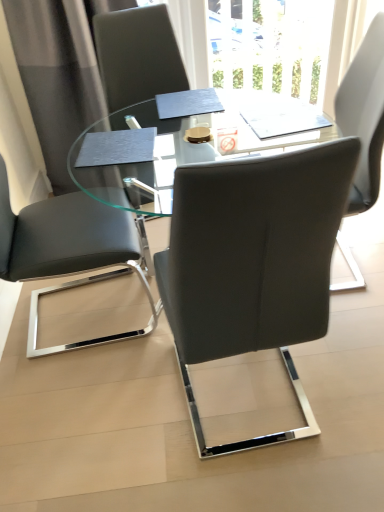
Image resolution: width=384 pixels, height=512 pixels. What are the coordinates of `vacant space underneath matte black chair at left, acting as the 2th chair starting from the right (from a real-world perspective)` in the screenshot? It's located at (82, 315).